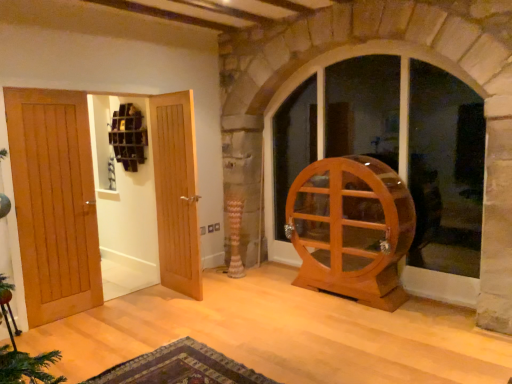
Locate an element on the screen. This screenshot has width=512, height=384. vacant region above light brown wood door at left, the 1th door viewed from the left (from a real-world perspective) is located at coordinates (47, 92).